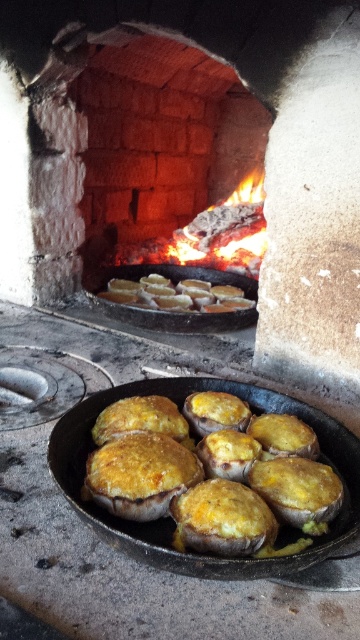
Who is more forward, [120,259] or [209,292]?

Point [209,292] is more forward.

Between charcoal wood fire at center and golden-brown crusty bread at center, which one appears on the right side from the viewer's perspective?

charcoal wood fire at center

Which is behind, point (234, 225) or point (165, 282)?

The point (234, 225) is more distant.

This screenshot has height=640, width=360. I want to click on charcoal wood fire at center, so click(213, 234).

Consider the image. Is golden-brown crusty mushroom caps at center wider than golden-brown crusty bread at center?

No.

Is point (258, 426) less distant than point (159, 284)?

Yes, point (258, 426) is in front of point (159, 284).

Identify the location of golden-brown crusty mushroom caps at center. Image resolution: width=360 pixels, height=640 pixels. (209, 472).

In the scene shown: Is golden-brown crusty mushroom caps at center positioned in front of charcoal wood fire at center?

That is True.

This screenshot has height=640, width=360. Describe the element at coordinates (209, 472) in the screenshot. I see `golden-brown crusty mushroom caps at center` at that location.

From the picture: Who is more distant from viewer, (262, 435) or (234, 198)?

Positioned behind is point (234, 198).

Locate an element on the screen. The image size is (360, 640). golden-brown crusty mushroom caps at center is located at coordinates (209, 472).